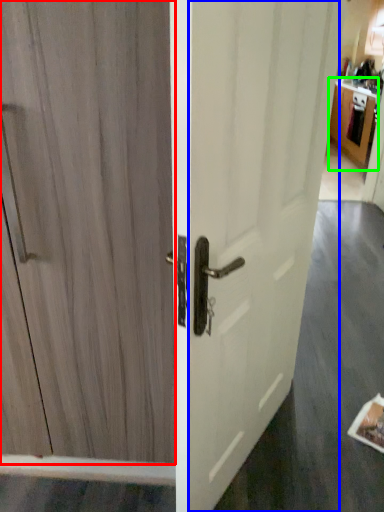
Question: Estimate the real-world distances between objects in this image. Which object is closer to door (highlighted by a red box), screen door (highlighted by a blue box) or cabinetry (highlighted by a green box)?

Choices:
 (A) screen door
 (B) cabinetry

Answer: (A)